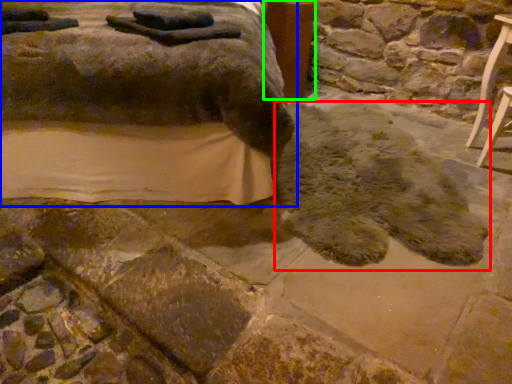
Question: Which object is the farthest from footprint (highlighted by a red box)? Choose among these: furniture (highlighted by a blue box) or table (highlighted by a green box).

Choices:
 (A) furniture
 (B) table

Answer: (B)